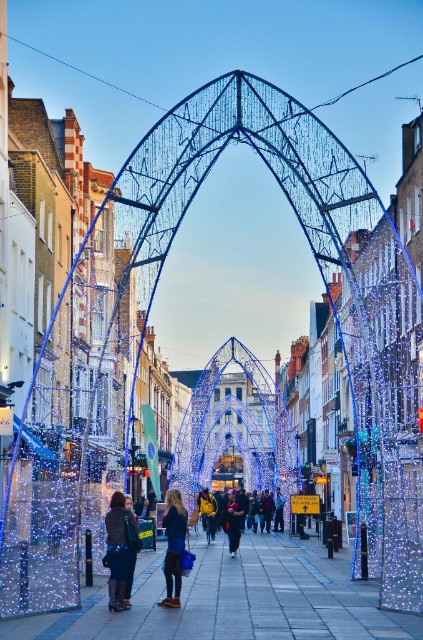
Question: Is dark blue fabric coat at center thinner than yellow fabric jacket at center?

Choices:
 (A) yes
 (B) no

Answer: (A)

Question: Which of the following is the closest to the observer?

Choices:
 (A) (x=279, y=504)
 (B) (x=214, y=497)

Answer: (A)

Question: Observing the image, what is the correct spatial positioning of dark blue fabric coat at center in reference to yellow fabric jacket at center?

Choices:
 (A) right
 (B) left

Answer: (B)

Question: Considering the real-world distances, which object is closest to the dark blue fabric jacket at center?

Choices:
 (A) illuminated wireframe arch at center
 (B) dark blue fabric coat at center

Answer: (B)

Question: Can you confirm if illuminated wireframe arch at center is bigger than dark brown leather jacket at lower left?

Choices:
 (A) no
 (B) yes

Answer: (B)

Question: Which object appears closest to the camera in this image?

Choices:
 (A) dark brown leather jacket at lower left
 (B) black fabric jacket at center
 (C) illuminated wireframe arch at center
 (D) dark blue fabric coat at center

Answer: (A)